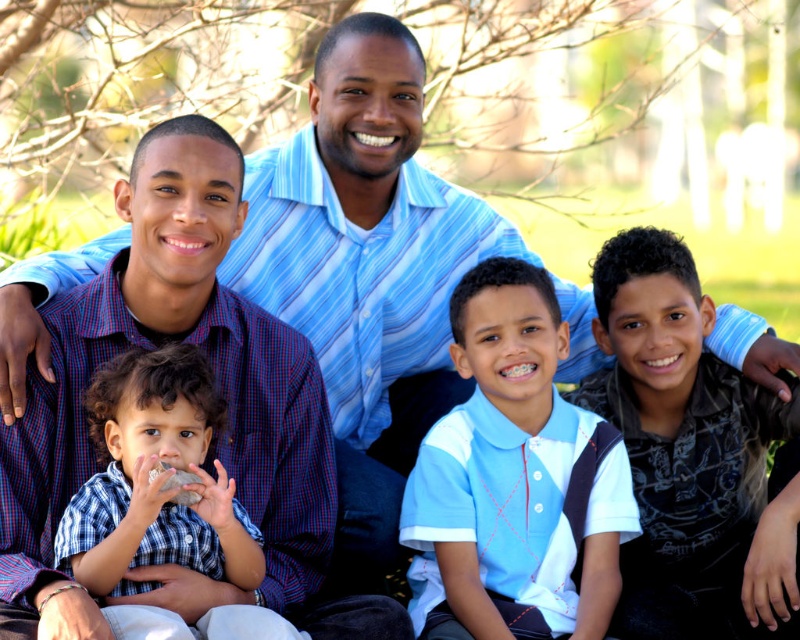
Can you confirm if light blue cotton polo shirt at center is bigger than dark blue printed shirt at center?

No.

Between light blue cotton polo shirt at center and dark blue printed shirt at center, which one has more height?

dark blue printed shirt at center is taller.

What do you see at coordinates (514, 477) in the screenshot? I see `light blue cotton polo shirt at center` at bounding box center [514, 477].

Identify the location of light blue cotton polo shirt at center. This screenshot has width=800, height=640. click(x=514, y=477).

Between light blue cotton polo shirt at center and checkered fabric shirt at center, which one appears on the right side from the viewer's perspective?

light blue cotton polo shirt at center is more to the right.

The width and height of the screenshot is (800, 640). What do you see at coordinates (514, 477) in the screenshot?
I see `light blue cotton polo shirt at center` at bounding box center [514, 477].

Where is `light blue cotton polo shirt at center`? light blue cotton polo shirt at center is located at coordinates (514, 477).

Is dark blue printed shirt at center above checkered fabric shirt at center?

Yes.

Which of these two, dark blue printed shirt at center or checkered fabric shirt at center, stands taller?

dark blue printed shirt at center

Who is more forward, (628, 564) or (189, 566)?

Point (189, 566)

Find the location of `dark blue printed shirt at center`. dark blue printed shirt at center is located at coordinates (x=688, y=452).